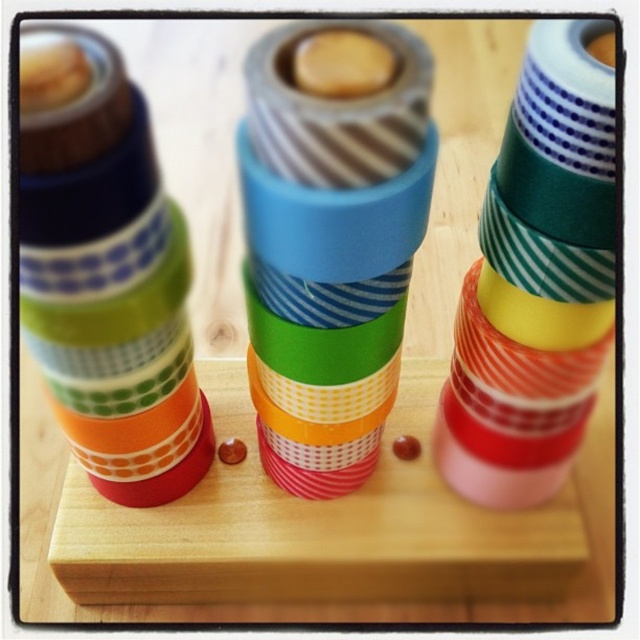
You are organizing items on a shelf and need to place the matte plastic cups at left and the matte plastic tape at center. According to the image, where should you position the cups relative to the tape?

The matte plastic cups at left should be placed to the left of the matte plastic tape at center, as the tape is to the right of the cups in the image.

You are standing in front of the washi tape display and want to pick up the item at point [307,332]. However, there is an obstacle at point [108,492]. Can you reach the first point without moving the obstacle?

Point [307,332] is in front of point [108,492], so you can reach the first point without moving the obstacle because it is closer to you.